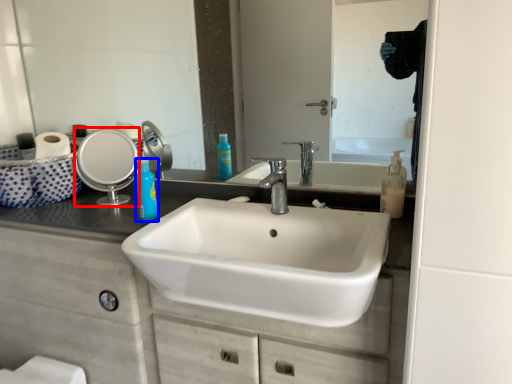
Question: Which object is further to the camera taking this photo, mirror (highlighted by a red box) or mouthwash (highlighted by a blue box)?

Choices:
 (A) mirror
 (B) mouthwash

Answer: (A)